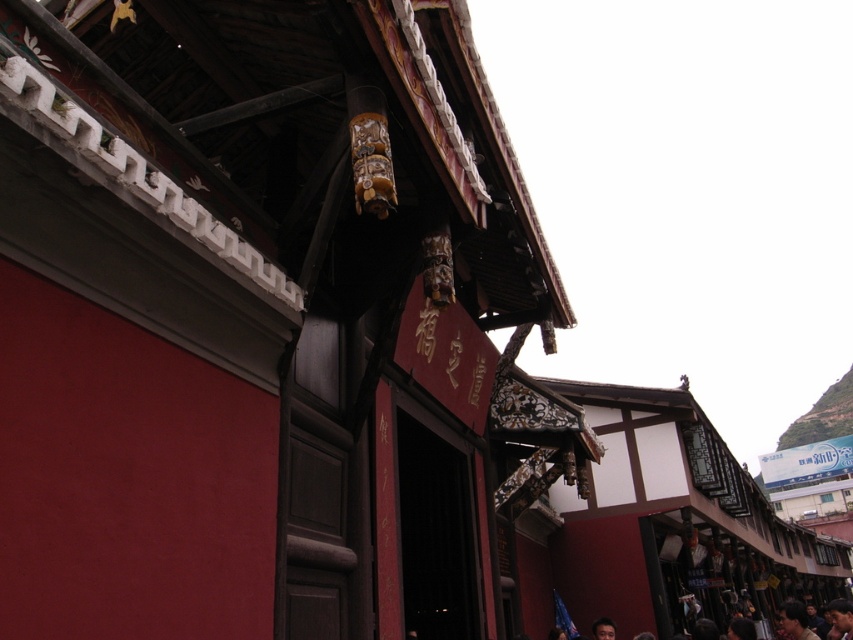
Question: Which object appears farthest from the camera in this image?

Choices:
 (A) smooth skin face at lower center
 (B) dark brown leather jacket at lower right
 (C) dark brown hair at lower right

Answer: (A)

Question: Among these points, which one is nearest to the camera?

Choices:
 (A) (837, 616)
 (B) (793, 604)
 (C) (601, 618)

Answer: (B)

Question: Observing the image, what is the correct spatial positioning of dark brown leather jacket at lower right in reference to dark brown hair at lower right?

Choices:
 (A) left
 (B) right

Answer: (B)

Question: Observing the image, what is the correct spatial positioning of dark brown leather jacket at lower right in reference to smooth skin face at lower center?

Choices:
 (A) left
 (B) right

Answer: (B)

Question: In this image, where is dark brown hair at lower right located relative to smooth skin face at lower center?

Choices:
 (A) right
 (B) left

Answer: (A)

Question: Which point is farther to the camera?

Choices:
 (A) dark brown hair at lower right
 (B) smooth skin face at lower center

Answer: (B)